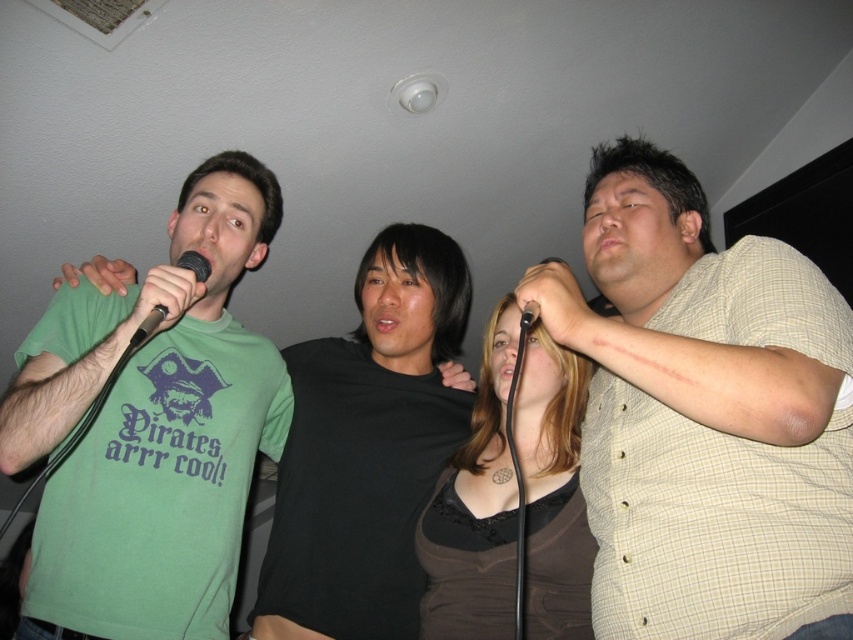
You are a photographer trying to capture a clear photo of the black matte shirt at center and the black matte microphone at upper center. Since both are black, you want to ensure the microphone stands out. Based on the scene, which object should you focus on to make sure the microphone is visible?

The black matte microphone at upper center is behind the black matte shirt at center, so focusing on the black matte shirt at center would place the microphone in the background, making it harder to see. To ensure the microphone is visible, focus on the black matte microphone at upper center instead.

You are standing in a room where a karaoke session is happening. You see the black matte microphone at upper center. Can you reach it without moving your position?

The black matte microphone at upper center is 31.85 inches away from you, so yes, you can reach it without moving your position since it is within arm reach.